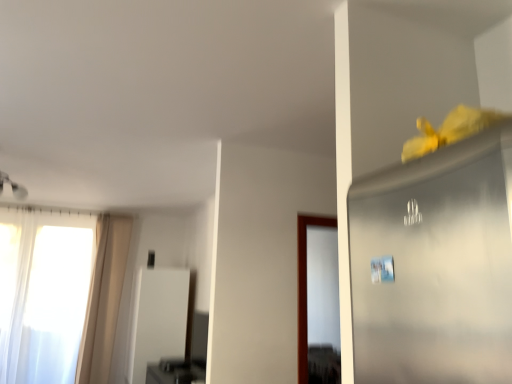
Question: From the image's perspective, is white sheer curtain at left on beige fabric curtain at left?

Choices:
 (A) no
 (B) yes

Answer: (A)

Question: Is the depth of white sheer curtain at left less than that of beige fabric curtain at left?

Choices:
 (A) yes
 (B) no

Answer: (A)

Question: From the image's perspective, is white sheer curtain at left under beige fabric curtain at left?

Choices:
 (A) yes
 (B) no

Answer: (A)

Question: From a real-world perspective, is white sheer curtain at left over beige fabric curtain at left?

Choices:
 (A) yes
 (B) no

Answer: (B)

Question: Would you say white sheer curtain at left is outside beige fabric curtain at left?

Choices:
 (A) yes
 (B) no

Answer: (A)

Question: Do you think white glossy screen door at center is within beige fabric curtain at left, or outside of it?

Choices:
 (A) inside
 (B) outside

Answer: (B)

Question: From the image's perspective, relative to beige fabric curtain at left, is white glossy screen door at center above or below?

Choices:
 (A) above
 (B) below

Answer: (B)

Question: Visually, is white glossy screen door at center positioned to the left or to the right of beige fabric curtain at left?

Choices:
 (A) left
 (B) right

Answer: (B)

Question: In terms of width, does white glossy screen door at center look wider or thinner when compared to beige fabric curtain at left?

Choices:
 (A) wide
 (B) thin

Answer: (A)

Question: From the image's perspective, is white sheer curtain at left positioned above or below beige fabric curtain at left?

Choices:
 (A) above
 (B) below

Answer: (B)

Question: Considering the positions of white sheer curtain at left and beige fabric curtain at left in the image, is white sheer curtain at left bigger or smaller than beige fabric curtain at left?

Choices:
 (A) big
 (B) small

Answer: (A)

Question: Considering the positions of white sheer curtain at left and beige fabric curtain at left in the image, is white sheer curtain at left wider or thinner than beige fabric curtain at left?

Choices:
 (A) wide
 (B) thin

Answer: (A)

Question: In the image, is white sheer curtain at left on the left side or the right side of beige fabric curtain at left?

Choices:
 (A) left
 (B) right

Answer: (A)

Question: From their relative heights in the image, would you say beige fabric curtain at left is taller or shorter than white glossy screen door at center?

Choices:
 (A) short
 (B) tall

Answer: (B)

Question: From the image's perspective, is beige fabric curtain at left positioned above or below white glossy screen door at center?

Choices:
 (A) below
 (B) above

Answer: (B)